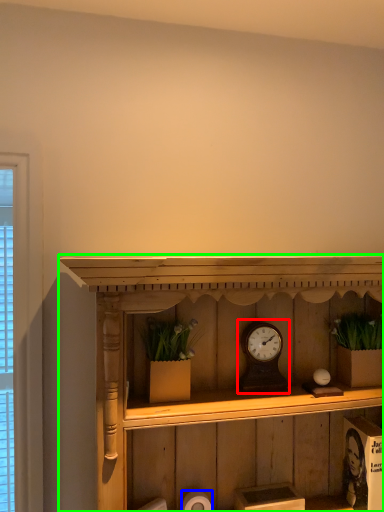
Question: Considering the real-world distances, which object is farthest from alarm clock (highlighted by a red box)? toilet paper (highlighted by a blue box) or shelf (highlighted by a green box)?

Choices:
 (A) toilet paper
 (B) shelf

Answer: (A)